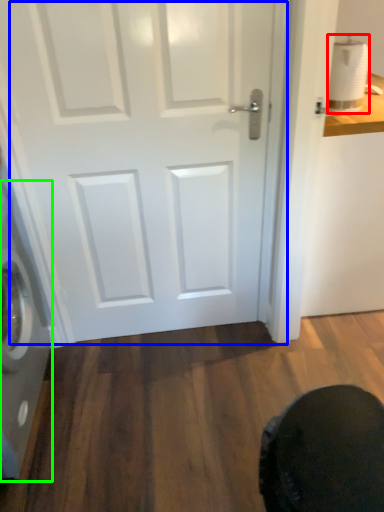
Question: Based on their relative distances, which object is nearer to toilet paper (highlighted by a red box)? Choose from door (highlighted by a blue box) and washing machine (highlighted by a green box).

Choices:
 (A) door
 (B) washing machine

Answer: (A)